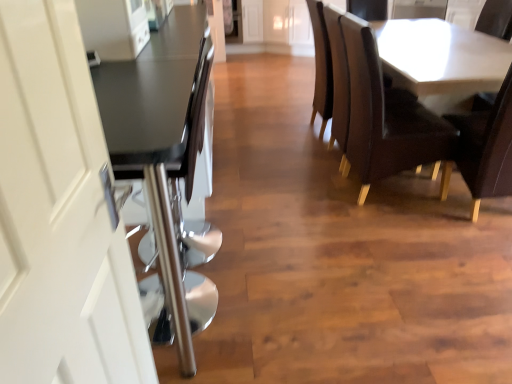
Question: Would you consider white glossy table at upper right, the first table from the right, to be distant from matte black table at left, acting as the 1th table starting from the left?

Choices:
 (A) no
 (B) yes

Answer: (B)

Question: Is white glossy table at upper right, which is the 2th table in front-to-back order, not within matte black table at left, acting as the 1th table starting from the left?

Choices:
 (A) no
 (B) yes

Answer: (B)

Question: Can you confirm if white glossy table at upper right, the 2th table from the left, is thinner than matte black table at left, which appears as the 2th table when viewed from the back?

Choices:
 (A) yes
 (B) no

Answer: (B)

Question: From the image's perspective, is white glossy table at upper right, which appears as the first table when viewed from the back, below matte black table at left, the 2th table when ordered from right to left?

Choices:
 (A) no
 (B) yes

Answer: (A)

Question: Can you confirm if white glossy table at upper right, which appears as the first table when viewed from the back, is positioned to the right of matte black table at left, which appears as the 2th table when viewed from the back?

Choices:
 (A) yes
 (B) no

Answer: (A)

Question: Relative to white glossy door handle at left, is white glossy table at upper right, the 2th table from the left, in front or behind?

Choices:
 (A) behind
 (B) front

Answer: (A)

Question: Is point (394, 61) closer or farther from the camera than point (55, 127)?

Choices:
 (A) farther
 (B) closer

Answer: (A)

Question: Is white glossy table at upper right, which is the 2th table in front-to-back order, to the left or to the right of white glossy door handle at left in the image?

Choices:
 (A) left
 (B) right

Answer: (B)

Question: From a real-world perspective, is white glossy table at upper right, the first table from the right, positioned above or below white glossy door handle at left?

Choices:
 (A) below
 (B) above

Answer: (A)

Question: Is point (98, 97) closer or farther from the camera than point (342, 38)?

Choices:
 (A) farther
 (B) closer

Answer: (B)

Question: Is matte black table at left, the 2th table when ordered from right to left, situated inside leather armchair at center or outside?

Choices:
 (A) inside
 (B) outside

Answer: (B)

Question: Relative to leather armchair at center, is matte black table at left, which appears as the 2th table when viewed from the back, in front or behind?

Choices:
 (A) behind
 (B) front

Answer: (B)

Question: Visually, is matte black table at left, arranged as the first table when viewed from the front, positioned to the left or to the right of leather armchair at center?

Choices:
 (A) left
 (B) right

Answer: (A)

Question: Relative to matte black table at left, acting as the 1th table starting from the left, is white glossy door handle at left in front or behind?

Choices:
 (A) behind
 (B) front

Answer: (B)

Question: Based on their positions, is white glossy door handle at left located to the left or right of matte black table at left, the 2th table when ordered from right to left?

Choices:
 (A) right
 (B) left

Answer: (A)